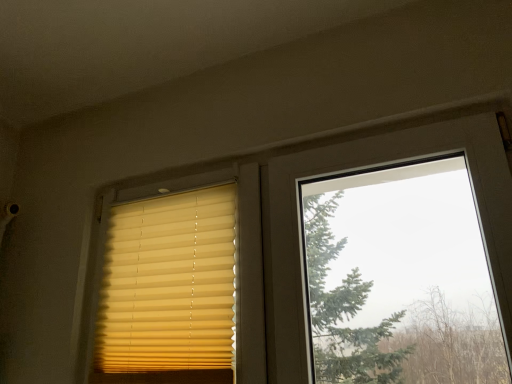
Measure the distance between point (115, 207) and camera.

Point (115, 207) and camera are 1.28 meters apart.

Find the location of a particular element. The height and width of the screenshot is (384, 512). matte yellow blinds at left is located at coordinates (169, 284).

Image resolution: width=512 pixels, height=384 pixels. What do you see at coordinates (169, 284) in the screenshot?
I see `matte yellow blinds at left` at bounding box center [169, 284].

What is the approximate width of matte yellow blinds at left?

1.22 inches.

Identify the location of matte yellow blinds at left. This screenshot has width=512, height=384. (169, 284).